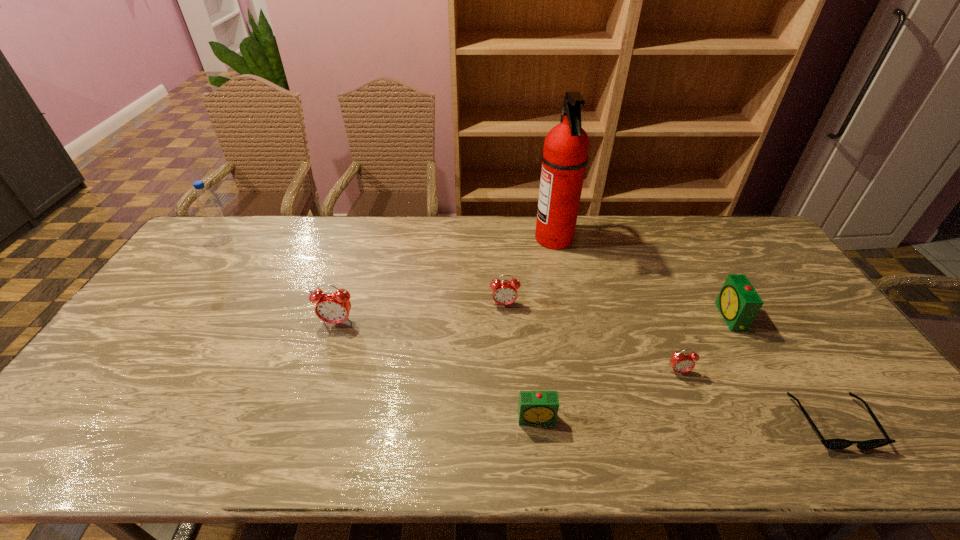
Where is `vacant area located 0.050m on the face of the seventh object from right to left`? vacant area located 0.050m on the face of the seventh object from right to left is located at coordinates (331, 342).

Where is `free space located 0.330m on the face of the second biggest red alarm clock`? free space located 0.330m on the face of the second biggest red alarm clock is located at coordinates (510, 406).

Identify the location of vacant region located 0.090m on the front-facing side of the rightmost alarm clock. (691, 318).

Where is `vacant space located on the front-facing side of the rightmost alarm clock`? The image size is (960, 540). vacant space located on the front-facing side of the rightmost alarm clock is located at coordinates (698, 318).

The height and width of the screenshot is (540, 960). I want to click on vacant space situated on the front-facing side of the rightmost alarm clock, so click(657, 318).

At what (x,y) coordinates should I click in order to perform the action: click on free location located 0.130m on the face of the sixth object from left to right. Please return your answer as a coordinate pair (x, y). The image size is (960, 540). Looking at the image, I should click on (699, 421).

Locate an element on the screen. vacant region located on the front-facing side of the nearer green alarm clock is located at coordinates (540, 446).

I want to click on fire extinguisher present at the far edge, so click(x=565, y=156).

Find the location of a particular element. water bottle located at the far edge is located at coordinates (220, 231).

Find the location of `object that is at the near edge`. object that is at the near edge is located at coordinates (835, 444).